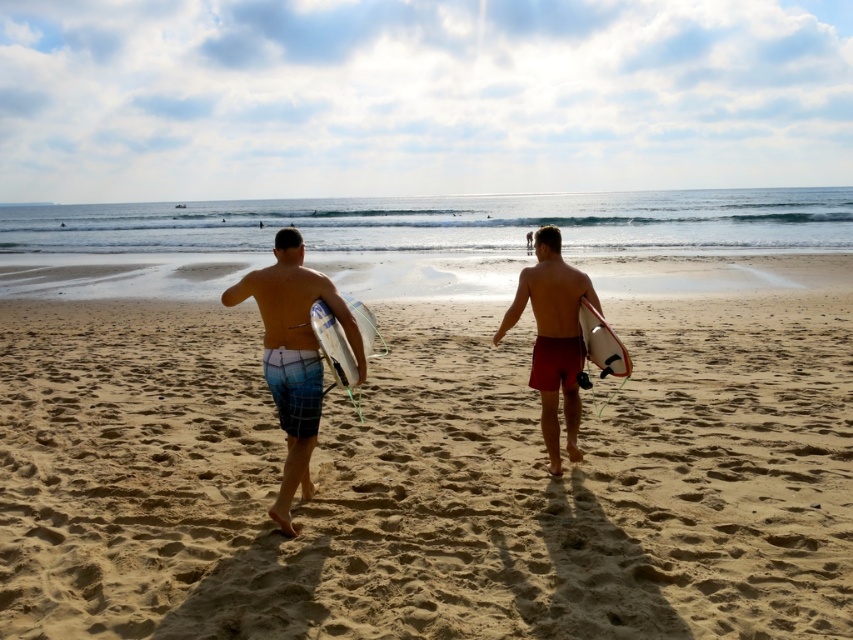
Question: In this image, where is blue plaid shorts at center located relative to matte red shorts at center?

Choices:
 (A) above
 (B) below

Answer: (B)

Question: Which point appears closest to the camera in this image?

Choices:
 (A) (554, 467)
 (B) (303, 280)

Answer: (B)

Question: Based on their relative distances, which object is farther from the white glossy surfboard at center?

Choices:
 (A) sandy yellow sand at center
 (B) blue plaid boardshorts at center
 (C) white matte surfboard at center
 (D) blue plaid shorts at center

Answer: (A)

Question: Where is blue plaid shorts at center located in relation to white matte surfboard at center in the image?

Choices:
 (A) right
 (B) left

Answer: (B)

Question: Which object is the closest to the white glossy surfboard at center?

Choices:
 (A) blue plaid boardshorts at center
 (B) matte red shorts at center
 (C) sandy yellow sand at center
 (D) white matte surfboard at center

Answer: (A)

Question: Is blue plaid boardshorts at center to the left of white glossy surfboard at center from the viewer's perspective?

Choices:
 (A) no
 (B) yes

Answer: (B)